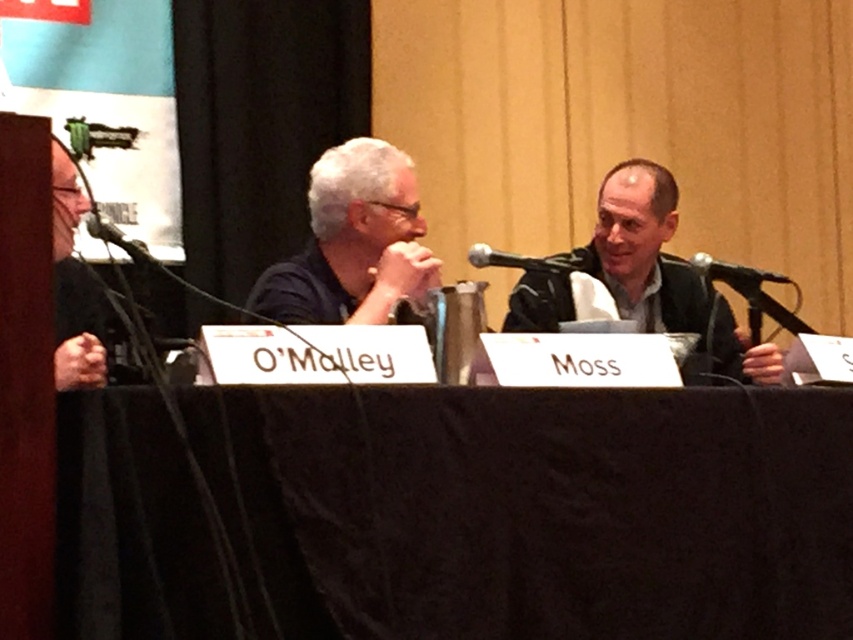
Which is more to the right, dark blue shirt at center or black metallic microphone at center?

Positioned to the right is black metallic microphone at center.

Who is lower down, dark blue shirt at center or black metallic microphone at center?

black metallic microphone at center

At what (x,y) coordinates should I click in order to perform the action: click on dark blue shirt at center. Please return your answer as a coordinate pair (x, y). Looking at the image, I should click on (352, 243).

Identify the location of dark blue shirt at center. pyautogui.click(x=352, y=243).

Can you confirm if black metallic microphone at center is positioned above black matte microphone at left?

Incorrect, black metallic microphone at center is not positioned above black matte microphone at left.

Identify the location of black metallic microphone at center. The image size is (853, 640). (515, 260).

Is point (311, 275) positioned in front of point (689, 264)?

Yes, it is.

Based on the photo, who is positioned more to the left, dark blue shirt at center or black plastic microphone at center?

From the viewer's perspective, dark blue shirt at center appears more on the left side.

Who is more distant from viewer, (399, 269) or (712, 262)?

The point (712, 262) is behind.

Where is `dark blue shirt at center`? The image size is (853, 640). dark blue shirt at center is located at coordinates (352, 243).